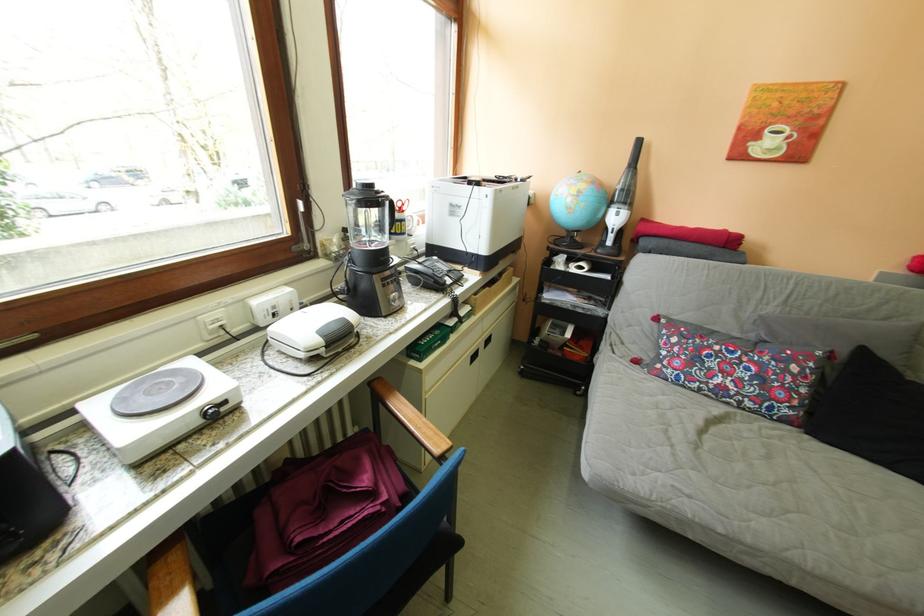
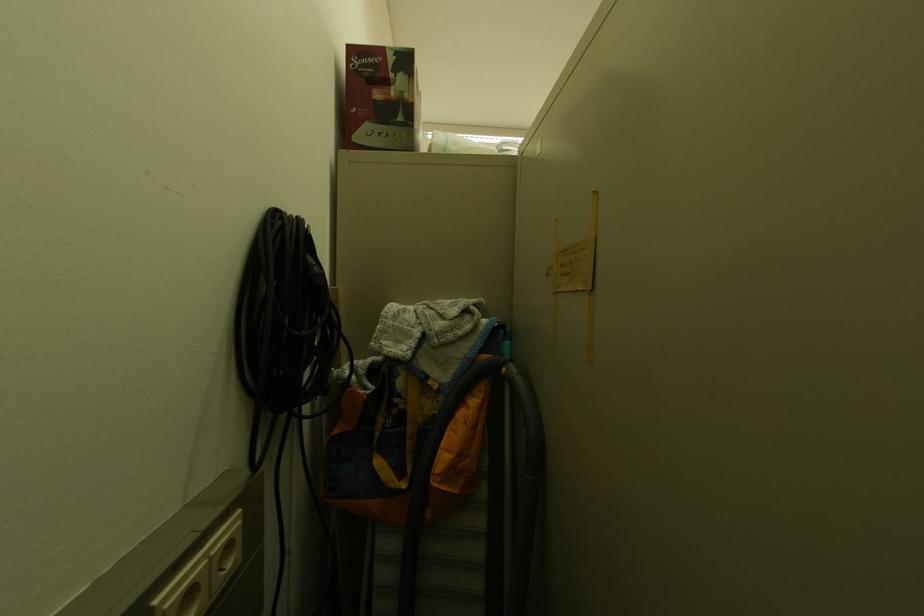
Question: I am providing you with two images of the same scene from different viewpoints. After the viewpoint changes to image2, which objects are now occluded?

Choices:
 (A) yellow and blue bag
 (B) black exercise handle
 (C) telephone handset
 (D) vacuum cleaner hose

Answer: (C)